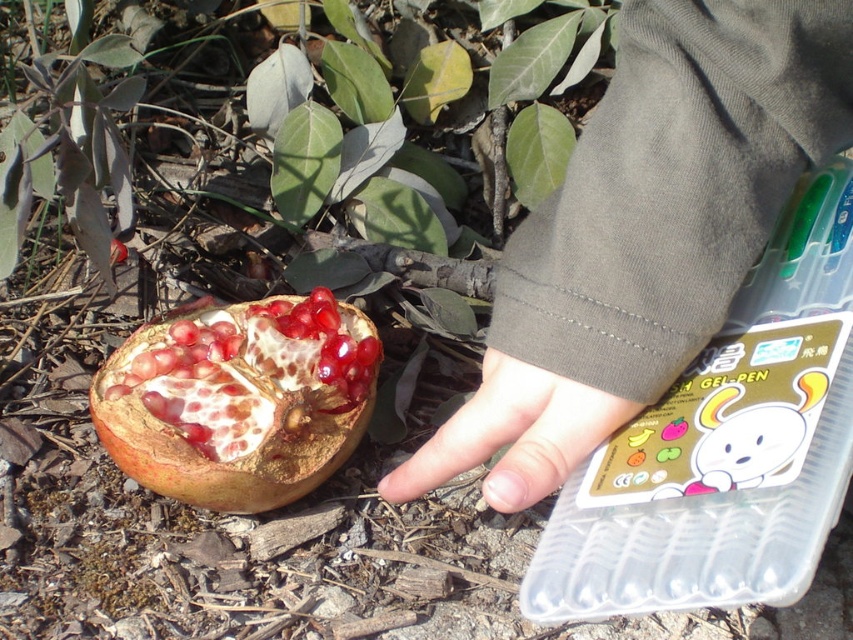
Question: Does shiny red pomegranate at lower left appear on the right side of smooth skin hand at center?

Choices:
 (A) yes
 (B) no

Answer: (B)

Question: Which point is farther to the camera?

Choices:
 (A) shiny red pomegranate at lower left
 (B) dark gray fabric at upper right

Answer: (A)

Question: Which of the following is the closest to the observer?

Choices:
 (A) (244, 433)
 (B) (445, 428)

Answer: (B)

Question: Which is farther from the dark gray fabric at upper right?

Choices:
 (A) smooth skin hand at center
 (B) shiny red pomegranate at lower left

Answer: (B)

Question: Does dark gray fabric at upper right have a larger size compared to smooth skin hand at center?

Choices:
 (A) no
 (B) yes

Answer: (B)

Question: Can you confirm if dark gray fabric at upper right is wider than shiny red pomegranate at lower left?

Choices:
 (A) yes
 (B) no

Answer: (B)